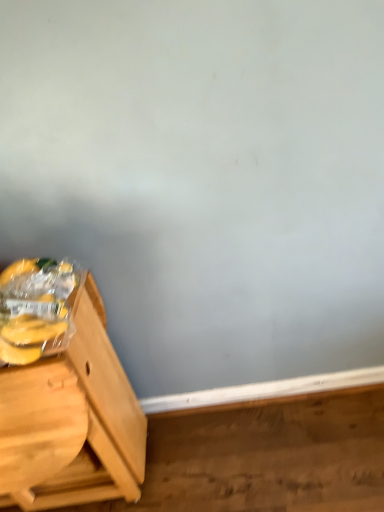
Question: Is light brown wood table at left in contact with yellow matte plastic bananas at left?

Choices:
 (A) yes
 (B) no

Answer: (B)

Question: Is yellow matte plastic bananas at left a part of light brown wood table at left?

Choices:
 (A) no
 (B) yes

Answer: (A)

Question: Could you tell me if light brown wood table at left is turned towards yellow matte plastic bananas at left?

Choices:
 (A) no
 (B) yes

Answer: (A)

Question: Does light brown wood table at left have a larger size compared to yellow matte plastic bananas at left?

Choices:
 (A) yes
 (B) no

Answer: (A)

Question: From a real-world perspective, is light brown wood table at left located beneath yellow matte plastic bananas at left?

Choices:
 (A) yes
 (B) no

Answer: (A)

Question: Does light brown wood table at left have a greater height compared to yellow matte plastic bananas at left?

Choices:
 (A) yes
 (B) no

Answer: (A)

Question: Is yellow matte plastic bananas at left positioned beyond the bounds of light brown wood table at left?

Choices:
 (A) no
 (B) yes

Answer: (B)

Question: From the image's perspective, is yellow matte plastic bananas at left under light brown wood table at left?

Choices:
 (A) no
 (B) yes

Answer: (A)

Question: From the image's perspective, is yellow matte plastic bananas at left on light brown wood table at left?

Choices:
 (A) yes
 (B) no

Answer: (A)

Question: Does yellow matte plastic bananas at left have a greater width compared to light brown wood table at left?

Choices:
 (A) no
 (B) yes

Answer: (A)

Question: Is yellow matte plastic bananas at left with light brown wood table at left?

Choices:
 (A) yes
 (B) no

Answer: (B)

Question: Does yellow matte plastic bananas at left have a larger size compared to light brown wood table at left?

Choices:
 (A) yes
 (B) no

Answer: (B)

Question: Is yellow matte plastic bananas at left wider or thinner than light brown wood table at left?

Choices:
 (A) thin
 (B) wide

Answer: (A)